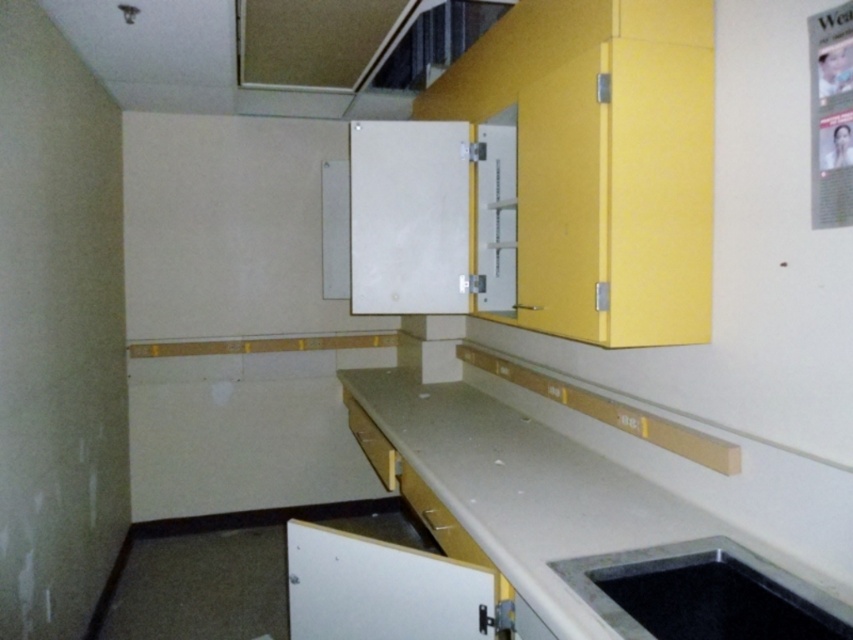
You are a contractor assessing the kitchen layout. The white laminate countertop at center and the black granite sink at lower right need to be positioned in a way that maximizes space efficiency. Given their sizes, which object should be placed in the area where more space is available?

The white laminate countertop at center should be placed in the area with more space since it is larger in size than the black granite sink at lower right.

You are a plumber working in the kitchen and need to access the pipes under the black granite sink at lower right. Can you reach them easily from behind the white laminate countertop at center?

The white laminate countertop at center is in front of the black granite sink at lower right, so you can easily access the pipes under the sink from behind the countertop.

You are a plumber working in this kitchen. You need to access the pipes under the black granite sink at lower right. Can you reach them from beneath the white laminate countertop at center?

The white laminate countertop at center is above the black granite sink at lower right, so the pipes under the sink are accessible from beneath the countertop.